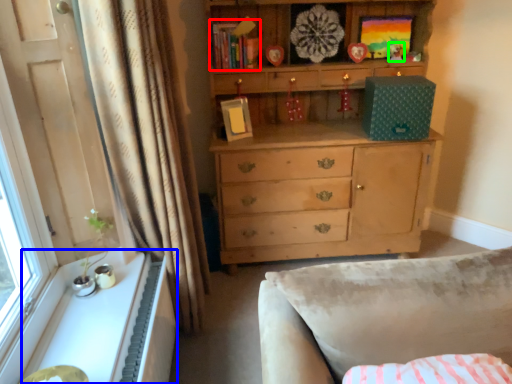
Question: Based on their relative distances, which object is farther from book (highlighted by a red box)? Choose from cabinetry (highlighted by a blue box) and toy (highlighted by a green box).

Choices:
 (A) cabinetry
 (B) toy

Answer: (A)